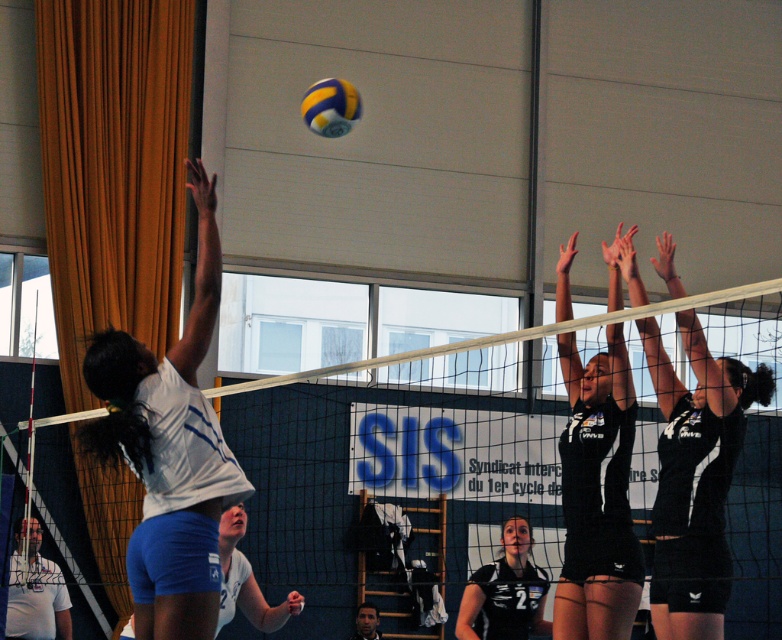
This screenshot has width=782, height=640. What do you see at coordinates (694, 477) in the screenshot?
I see `black matte volleyball net at upper center` at bounding box center [694, 477].

Can you confirm if black matte volleyball net at upper center is wider than black jersey at center?

Yes.

Who is more forward, (734, 384) or (508, 570)?

Point (734, 384) is more forward.

This screenshot has width=782, height=640. In order to click on black matte volleyball net at upper center in this screenshot , I will do `click(694, 477)`.

Does point (664, 596) come closer to viewer compared to point (576, 600)?

Yes, point (664, 596) is in front of point (576, 600).

The image size is (782, 640). Identify the location of black matte volleyball net at upper center. (694, 477).

Does white matte/vinyl volleyball player at upper center have a smaller size compared to yellowmaterial/texturevolleyball at upper center?

Actually, white matte/vinyl volleyball player at upper center might be larger than yellowmaterial/texturevolleyball at upper center.

Does point (199, 285) come farther from viewer compared to point (314, 131)?

No, (199, 285) is closer to viewer.

Identify the location of white matte/vinyl volleyball player at upper center. (169, 451).